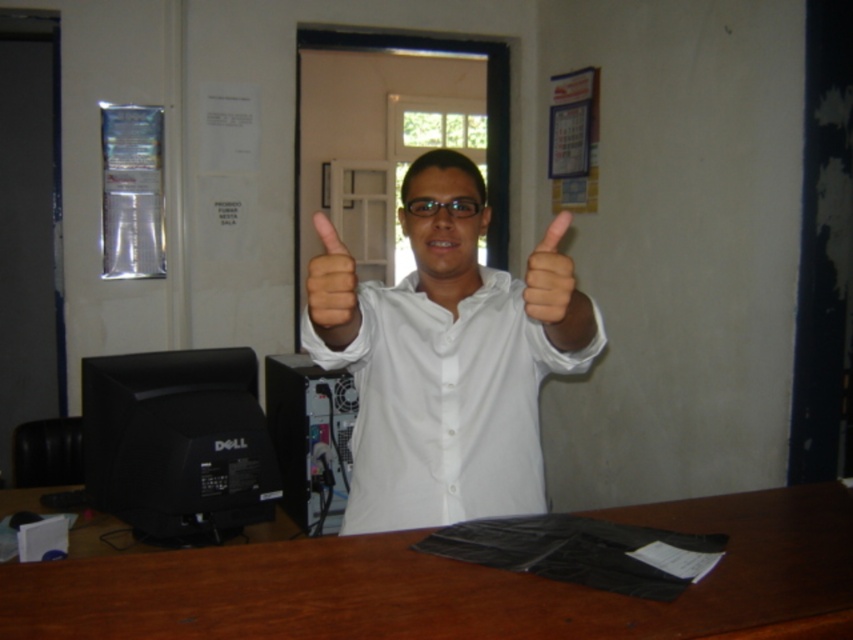
Does brown wood table at center have a greater width compared to skinny white hand at center?

Indeed, brown wood table at center has a greater width compared to skinny white hand at center.

Can you confirm if brown wood table at center is positioned to the left of skinny white hand at center?

No, brown wood table at center is not to the left of skinny white hand at center.

The height and width of the screenshot is (640, 853). What do you see at coordinates (456, 584) in the screenshot? I see `brown wood table at center` at bounding box center [456, 584].

The width and height of the screenshot is (853, 640). Identify the location of brown wood table at center. [x=456, y=584].

Based on the photo, does brown wood table at center have a greater width compared to matte white hand at center?

Yes.

Which is behind, point (370, 621) or point (567, 272)?

Point (567, 272)

Identify the location of brown wood table at center. (456, 584).

Is brown wood table at center thinner than white glossy shirt at center?

In fact, brown wood table at center might be wider than white glossy shirt at center.

Which is more to the right, brown wood table at center or white glossy shirt at center?

Positioned to the right is brown wood table at center.

What do you see at coordinates (456, 584) in the screenshot? I see `brown wood table at center` at bounding box center [456, 584].

Identify the location of brown wood table at center. (456, 584).